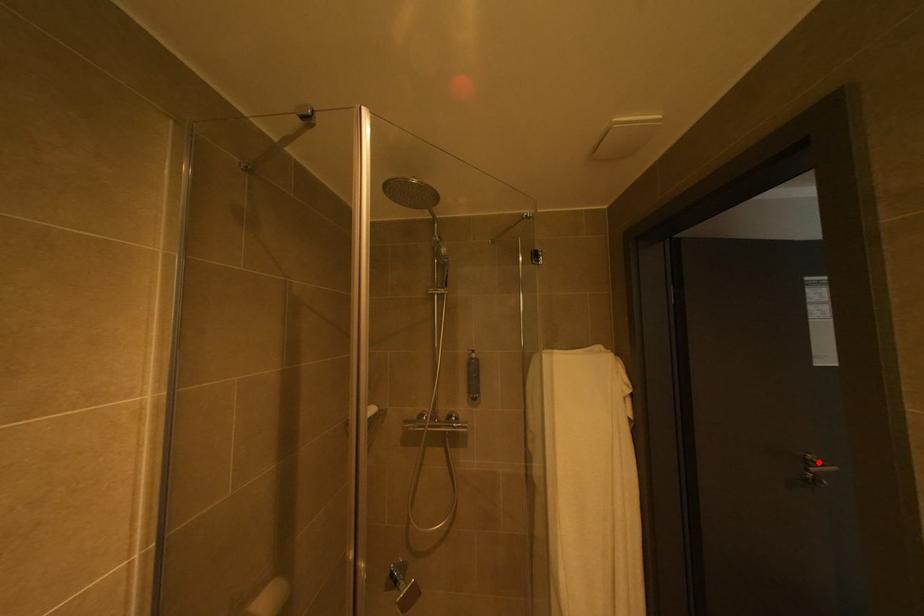
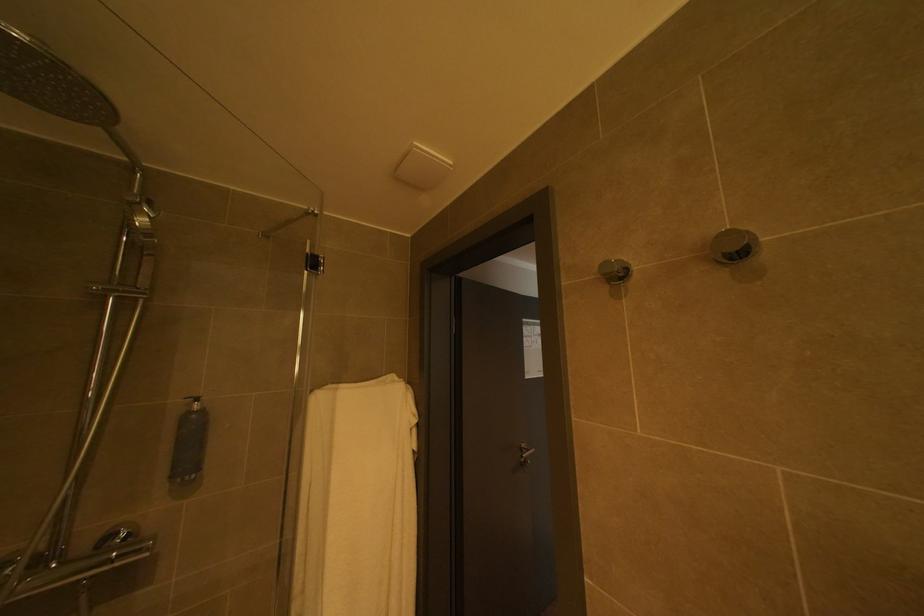
Question: I am providing you with two images of the same scene from different viewpoints. In image1, a red point is highlighted. Considering the same 3D point in image2, which of the following is correct?

Choices:
 (A) It is closer
 (B) It is farther

Answer: (A)